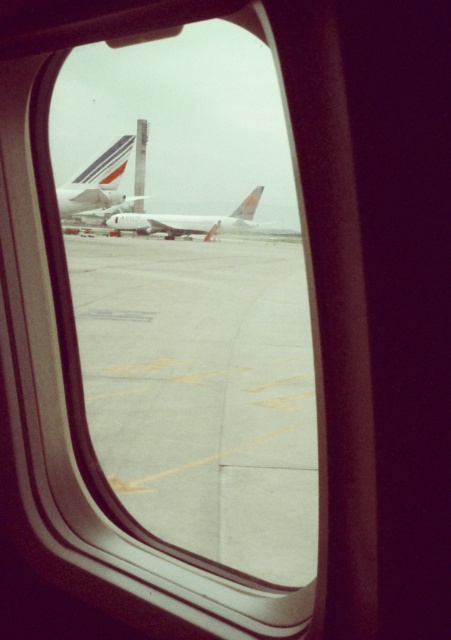
Question: Does white glossy airplane at center appear on the left side of white matte airplane at center?

Choices:
 (A) yes
 (B) no

Answer: (A)

Question: Which point is closer to the camera taking this photo?

Choices:
 (A) (113, 163)
 (B) (168, 272)

Answer: (B)

Question: Which point is farther to the camera?

Choices:
 (A) (143, 224)
 (B) (70, 193)

Answer: (A)

Question: Considering the relative positions of concrete tarmac at center and white matte airplane at center in the image provided, where is concrete tarmac at center located with respect to white matte airplane at center?

Choices:
 (A) above
 (B) below

Answer: (B)

Question: Which object appears closest to the camera in this image?

Choices:
 (A) concrete tarmac at center
 (B) white glossy airplane at center
 (C) white matte airplane at center

Answer: (A)

Question: Does white glossy airplane at center have a larger size compared to white matte airplane at center?

Choices:
 (A) yes
 (B) no

Answer: (A)